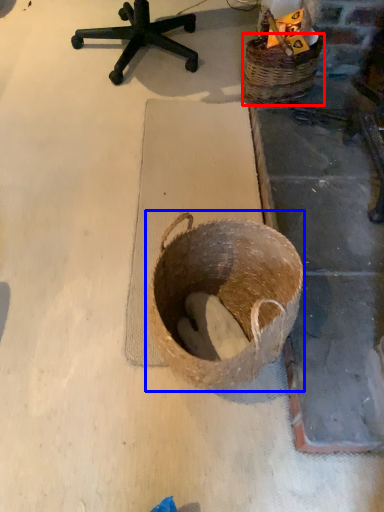
Question: Which point is closer to the camera, basket (highlighted by a red box) or basket (highlighted by a blue box)?

Choices:
 (A) basket
 (B) basket

Answer: (B)